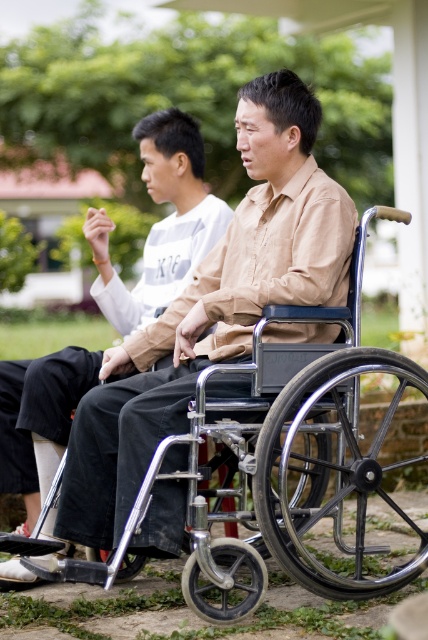
Question: In this image, where is metallic silver wheelchair at center located relative to matte black wheelchair at center?

Choices:
 (A) left
 (B) right

Answer: (B)

Question: Is metallic silver wheelchair at center below matte black wheelchair at center?

Choices:
 (A) yes
 (B) no

Answer: (A)

Question: Among these objects, which one is farthest from the camera?

Choices:
 (A) matte black wheelchair at center
 (B) metallic silver wheelchair at center

Answer: (A)

Question: Can you confirm if metallic silver wheelchair at center is positioned to the right of matte black wheelchair at center?

Choices:
 (A) no
 (B) yes

Answer: (B)

Question: Among these points, which one is nearest to the camera?

Choices:
 (A) (240, 467)
 (B) (50, 356)

Answer: (A)

Question: Among these points, which one is nearest to the camera?

Choices:
 (A) (193, 406)
 (B) (15, 472)

Answer: (A)